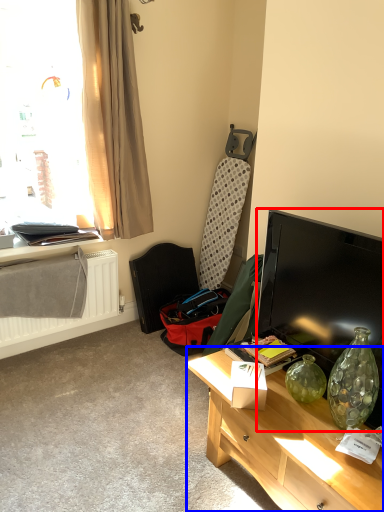
Question: Which object appears farthest to the camera in this image, television (highlighted by a red box) or desk (highlighted by a blue box)?

Choices:
 (A) television
 (B) desk

Answer: (A)